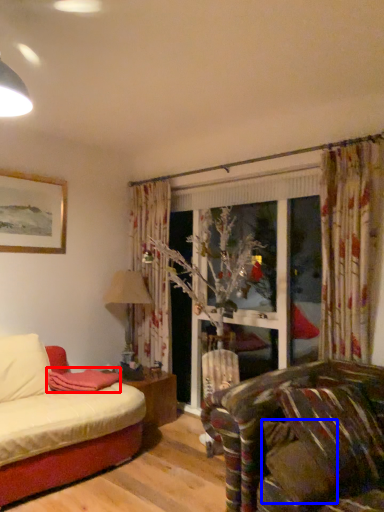
Question: Among these objects, which one is nearest to the camera, blanket (highlighted by a red box) or pillow (highlighted by a blue box)?

Choices:
 (A) blanket
 (B) pillow

Answer: (B)